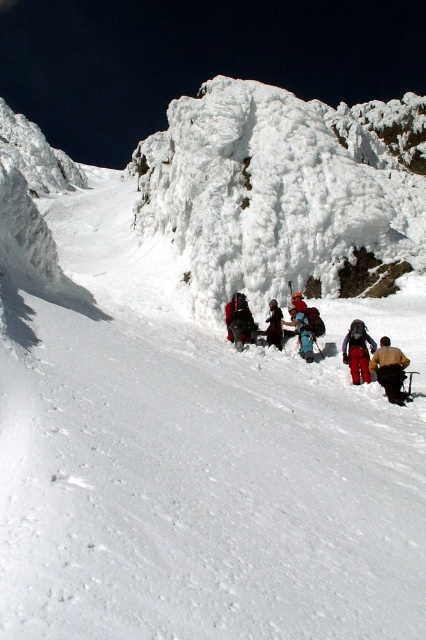
Question: Can you confirm if yellow fabric jacket at lower right is thinner than red fabric pants at lower right?

Choices:
 (A) no
 (B) yes

Answer: (A)

Question: Which point appears closest to the camera in this image?

Choices:
 (A) (270, 324)
 (B) (383, 342)
 (C) (357, 368)
 (D) (230, 320)

Answer: (B)

Question: Among these points, which one is nearest to the camera?

Choices:
 (A) (270, 305)
 (B) (233, 308)
 (C) (362, 365)
 (D) (379, 344)

Answer: (C)

Question: Among these objects, which one is nearest to the camera?

Choices:
 (A) yellow fabric jacket at lower right
 (B) red fabric jacket at center
 (C) red fabric pants at lower right

Answer: (A)

Question: Is yellow fabric jacket at lower right to the right of red fabric pants at lower right from the viewer's perspective?

Choices:
 (A) yes
 (B) no

Answer: (A)

Question: Is yellow fabric jacket at lower right smaller than blue fabric backpack at center?

Choices:
 (A) yes
 (B) no

Answer: (A)